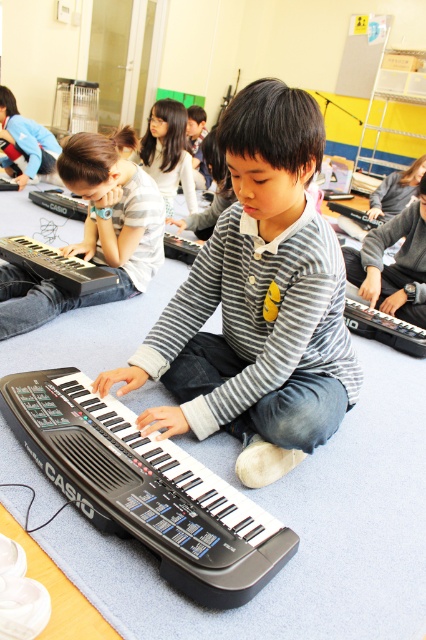
You are a music teacher in the classroom and need to choose a keyboard for a small child. Which keyboard, the black plastic keyboard at center or the matte black keyboard at lower left, is more suitable based on size?

The black plastic keyboard at center has a smaller size compared to the matte black keyboard at lower left, making it more suitable for a small child.

You are a music teacher in the classroom and want to place a 12 inch wide music book between the matte black keyboard at lower left and the black plastic keyboard at lower left. Will there be enough space?

The matte black keyboard at lower left is wider than the black plastic keyboard at lower left, so the combined width of both keyboards may not leave enough space for a 12 inch music book between them. Measure the distance between them first.